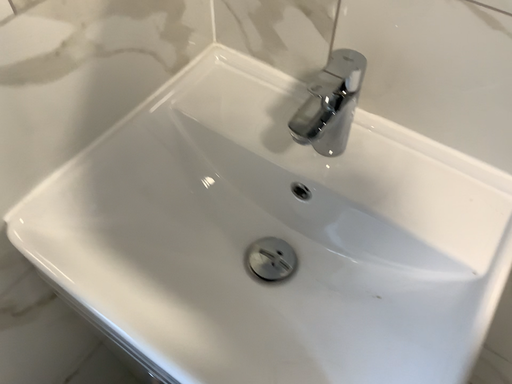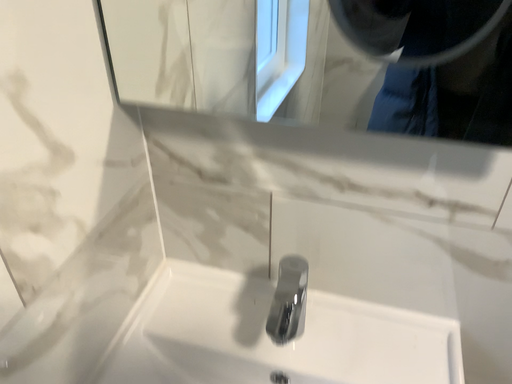
Question: Which way did the camera rotate in the video?

Choices:
 (A) rotated right
 (B) rotated left

Answer: (A)